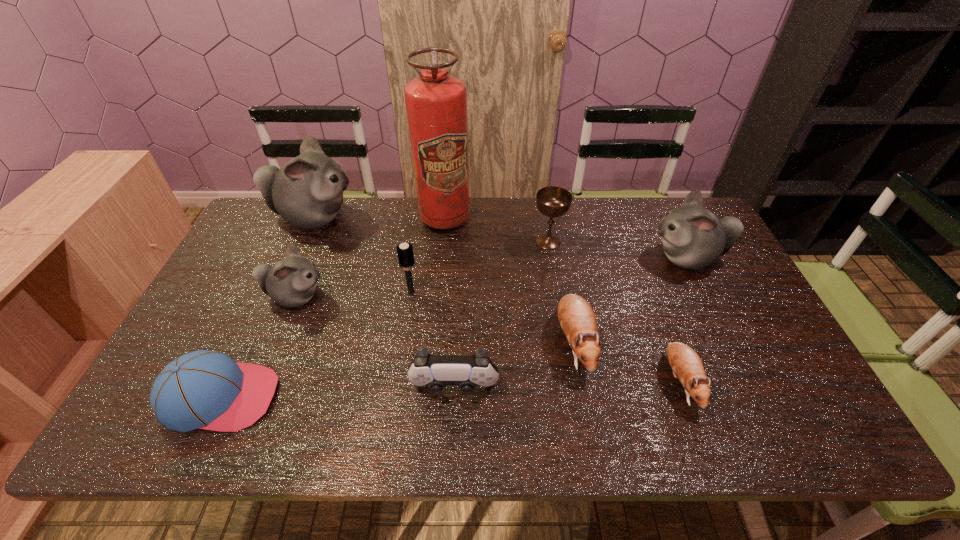
Locate an element on the screen. The height and width of the screenshot is (540, 960). fire extinguisher is located at coordinates (436, 103).

Locate an element on the screen. the tallest object is located at coordinates (436, 103).

Find the location of a particular element. This screenshot has width=960, height=540. the farthest hamster is located at coordinates (307, 192).

Identify the location of the biggest white hamster. The width and height of the screenshot is (960, 540). (307, 192).

The image size is (960, 540). Identify the location of the second smallest white hamster. (692, 237).

Image resolution: width=960 pixels, height=540 pixels. I want to click on the eighth shortest object, so click(692, 237).

Where is `chalice`? The height and width of the screenshot is (540, 960). chalice is located at coordinates tap(552, 201).

Where is `hairbrush`? hairbrush is located at coordinates click(x=405, y=253).

Identify the location of the third tallest hamster. Image resolution: width=960 pixels, height=540 pixels. (291, 282).

Where is `the smallest white hamster`? the smallest white hamster is located at coordinates (291, 282).